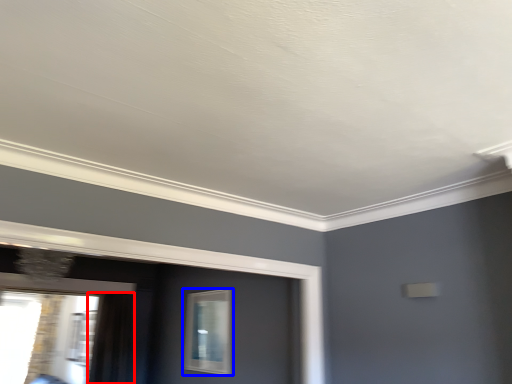
Question: Which of the following is the farthest to the observer, curtain (highlighted by a red box) or window (highlighted by a blue box)?

Choices:
 (A) curtain
 (B) window

Answer: (A)